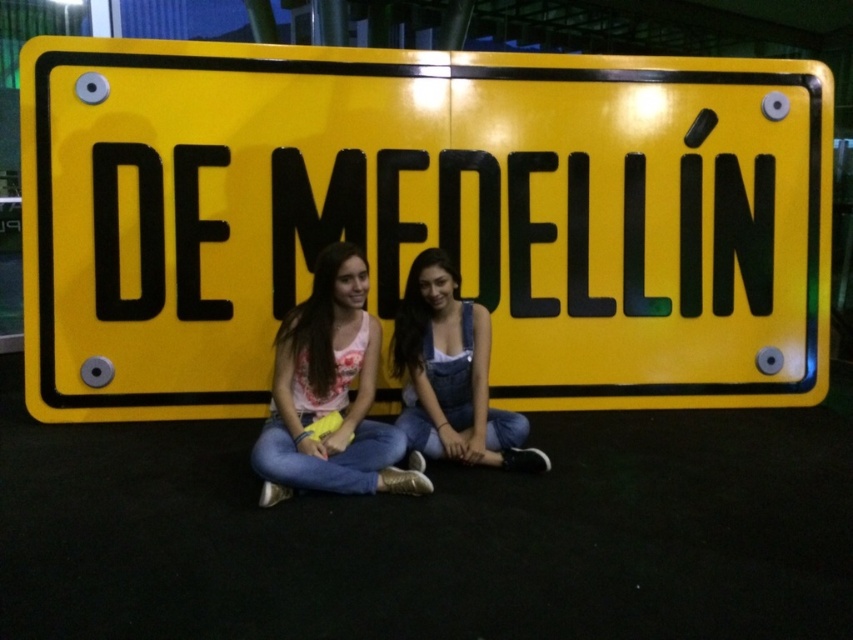
Question: Is yellow matte sign at center positioned at the back of matte pink shirt at center?

Choices:
 (A) yes
 (B) no

Answer: (A)

Question: Based on their relative distances, which object is farther from the yellow matte sign at center?

Choices:
 (A) matte pink shirt at center
 (B) denim overalls at center

Answer: (A)

Question: Which point is farther to the camera?

Choices:
 (A) yellow matte sign at center
 (B) denim overalls at center
 (C) matte pink shirt at center

Answer: (A)

Question: Which of the following is the closest to the observer?

Choices:
 (A) (276, 336)
 (B) (202, 176)
 (C) (521, 451)

Answer: (A)

Question: In this image, where is yellow matte sign at center located relative to matte pink shirt at center?

Choices:
 (A) right
 (B) left

Answer: (A)

Question: Is yellow matte sign at center closer to the viewer compared to denim overalls at center?

Choices:
 (A) no
 (B) yes

Answer: (A)